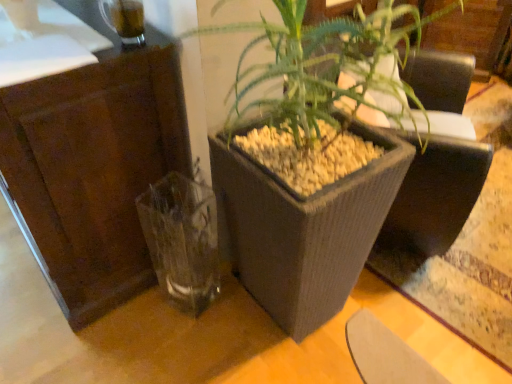
This screenshot has width=512, height=384. Identify the location of vacant area situated to the left side of transparent glass vase at lower left. (131, 317).